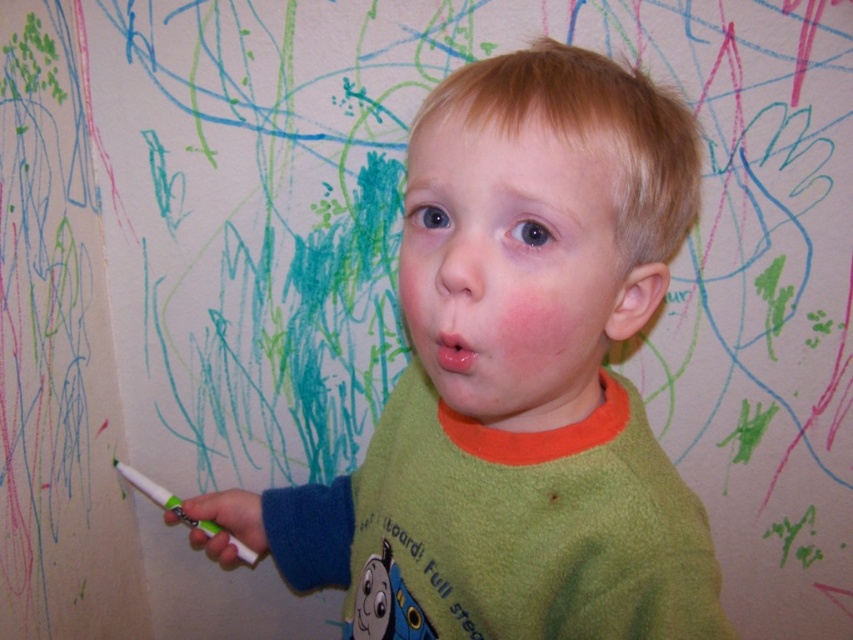
Question: Which point is farther to the camera?

Choices:
 (A) [x=642, y=412]
 (B) [x=206, y=531]

Answer: (B)

Question: Which object is closer to the camera taking this photo?

Choices:
 (A) green fleece shirt at center
 (B) white plastic crayon at lower left

Answer: (A)

Question: Which object appears farthest from the camera in this image?

Choices:
 (A) white plastic crayon at lower left
 (B) green fleece shirt at center

Answer: (A)

Question: Does green fleece shirt at center have a lesser width compared to white plastic crayon at lower left?

Choices:
 (A) no
 (B) yes

Answer: (A)

Question: In this image, where is green fleece shirt at center located relative to white plastic crayon at lower left?

Choices:
 (A) below
 (B) above

Answer: (B)

Question: Is green fleece shirt at center behind white plastic crayon at lower left?

Choices:
 (A) yes
 (B) no

Answer: (B)